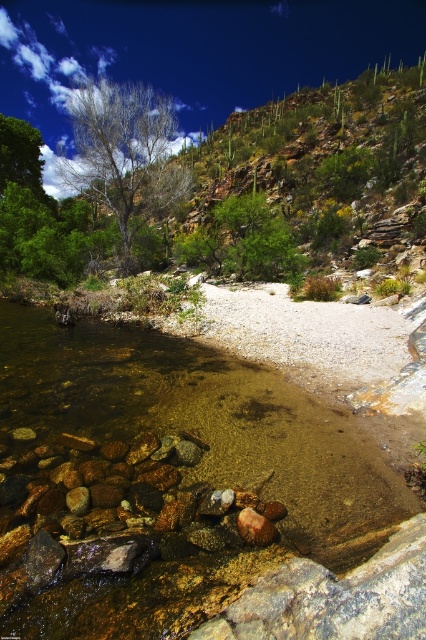
You are standing at the edge of the stream and want to cross to the other side. The translucent rock bed at lower left and the green leafy tree at center are visible. Which object is shorter in height?

The translucent rock bed at lower left has a lesser height compared to the green leafy tree at center, so the translucent rock bed at lower left is shorter in height.

You are standing at the center of the image and want to find the translucent rock bed at lower left. In which direction should you look to locate it?

The translucent rock bed at lower left is located at point (184, 499), so you should look to your lower left direction to find it.

A hiker wants to cross the stream using the natural pathway. They have a 4.5 meter long rope to secure their footing. Given the distance between the two points marked as point (92, 596), will the rope be sufficient to span the stream safely?

The distance between the two points marked as point (92, 596) is 4.21 meters. Since the rope is 4.5 meters long, it will be sufficient to span the stream safely.